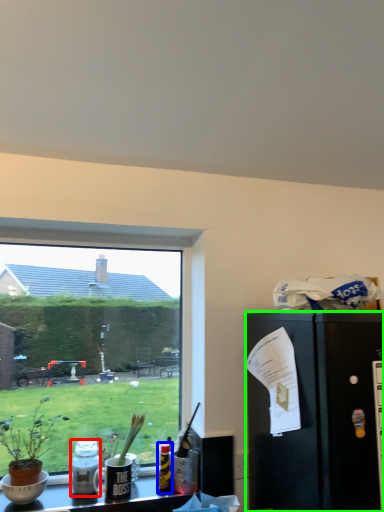
Question: Which object is positioned closest to bottle (highlighted by a red box)? Select from bottle (highlighted by a blue box) and refrigerator (highlighted by a green box).

Choices:
 (A) bottle
 (B) refrigerator

Answer: (A)